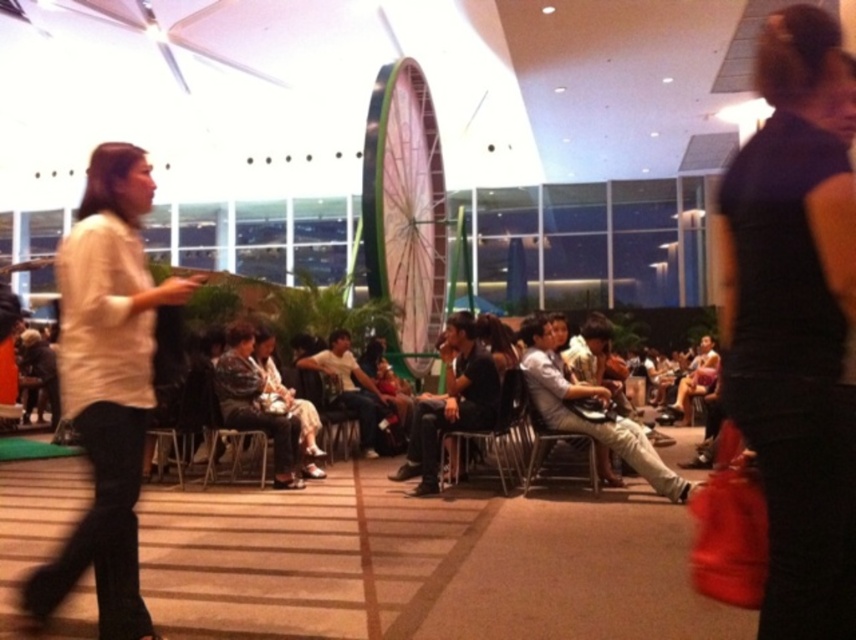
Does black plastic chair at center have a smaller size compared to wooden chair at center?

Actually, black plastic chair at center might be larger than wooden chair at center.

Where is `black plastic chair at center`? The image size is (856, 640). black plastic chair at center is located at coordinates (492, 433).

Identify the location of black plastic chair at center. The width and height of the screenshot is (856, 640). 492,433.

Is point (544, 426) in front of point (218, 404)?

Yes, point (544, 426) is in front of point (218, 404).

Find the location of a particular element. metallic gray chair at center is located at coordinates (551, 444).

Which is above, metallic silver chair at center or wooden chair at center?

wooden chair at center is higher up.

Is metallic silver chair at center smaller than wooden chair at center?

Actually, metallic silver chair at center might be larger than wooden chair at center.

Where is `metallic silver chair at center`? This screenshot has height=640, width=856. metallic silver chair at center is located at coordinates (232, 448).